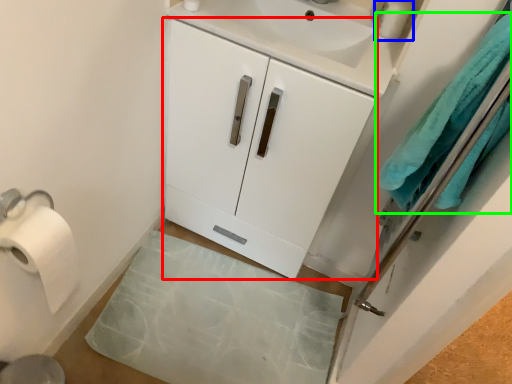
Question: Estimate the real-world distances between objects in this image. Which object is farther from cabinetry (highlighted by a red box), toiletry (highlighted by a blue box) or bath towel (highlighted by a green box)?

Choices:
 (A) toiletry
 (B) bath towel

Answer: (A)